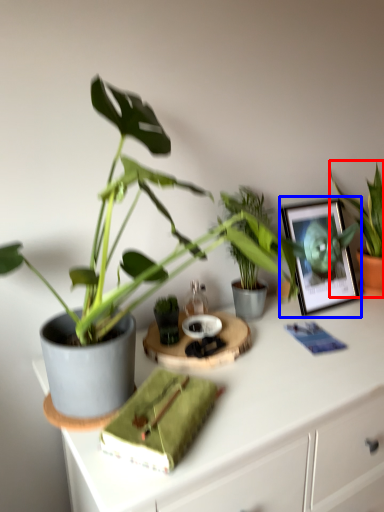
Question: Which object is closer to the camera taking this photo, houseplant (highlighted by a red box) or picture frame (highlighted by a blue box)?

Choices:
 (A) houseplant
 (B) picture frame

Answer: (B)